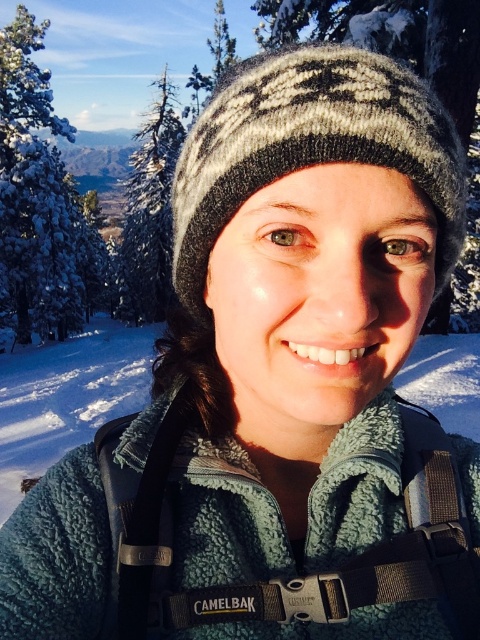
Is black nylon strap at center closer to the viewer compared to knitted woolen hat at center?

No, black nylon strap at center is behind knitted woolen hat at center.

Can you confirm if black nylon strap at center is thinner than knitted woolen hat at center?

Yes, black nylon strap at center is thinner than knitted woolen hat at center.

Where is `black nylon strap at center`? black nylon strap at center is located at coordinates (295, 545).

Is knitted woolen hat at center taller than white snow-covered tree at left?

No, knitted woolen hat at center is not taller than white snow-covered tree at left.

This screenshot has width=480, height=640. Describe the element at coordinates (311, 145) in the screenshot. I see `knitted woolen hat at center` at that location.

The height and width of the screenshot is (640, 480). Find the location of `knitted woolen hat at center`. knitted woolen hat at center is located at coordinates (311, 145).

Does white snow-covered tree at left appear over snow-covered branch at upper left?

Yes, white snow-covered tree at left is above snow-covered branch at upper left.

Who is lower down, white snow-covered tree at left or snow-covered branch at upper left?

snow-covered branch at upper left is below.

Which is behind, point (38, 96) or point (136, 289)?

The point (136, 289) is more distant.

Where is `white snow-covered tree at left`? The height and width of the screenshot is (640, 480). white snow-covered tree at left is located at coordinates (40, 202).